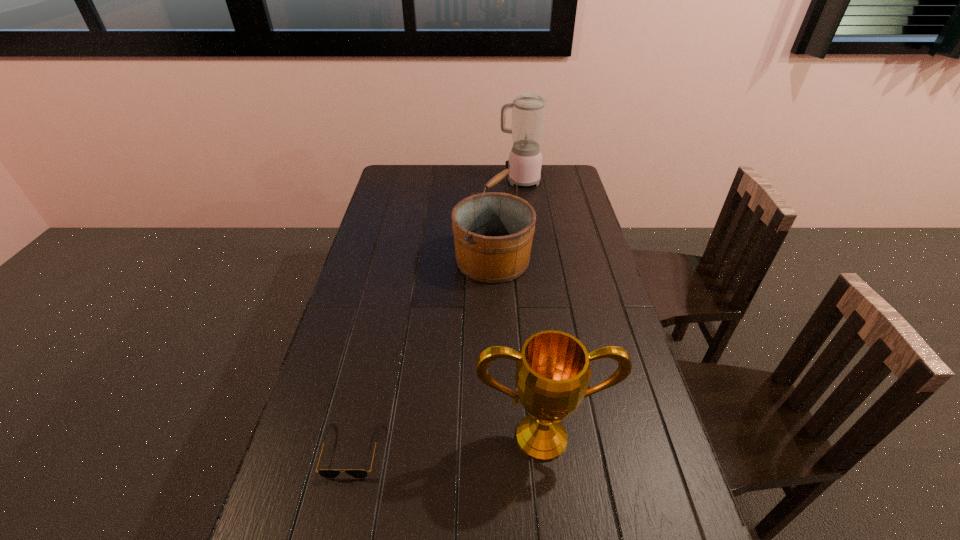
I want to click on object located in the far edge section of the desktop, so point(528,109).

The image size is (960, 540). I want to click on object present at the left edge, so click(325, 473).

Locate an element on the screen. This screenshot has width=960, height=540. food processor situated at the right edge is located at coordinates (528, 109).

Find the location of a particular element. Image resolution: width=960 pixels, height=540 pixels. award situated at the right edge is located at coordinates (553, 368).

You are a GUI agent. You are given a task and a screenshot of the screen. Output one action in this format:
    pyautogui.click(x=<x>, y=<y>)
    Task: Click on the object present at the far right corner
    
    Given the screenshot: What is the action you would take?
    pyautogui.click(x=528, y=109)

This screenshot has height=540, width=960. In order to click on vacant space at the far edge of the desktop in this screenshot , I will do `click(525, 186)`.

In order to click on vacant space at the left edge in this screenshot , I will do point(374,214).

In the image, there is a desktop. Where is `vacant space at the right edge`? vacant space at the right edge is located at coordinates (587, 290).

In the image, there is a desktop. Where is `vacant space at the far right corner`? Image resolution: width=960 pixels, height=540 pixels. vacant space at the far right corner is located at coordinates (568, 185).

You are a GUI agent. You are given a task and a screenshot of the screen. Output one action in this format:
    pyautogui.click(x=<x>, y=<y>)
    Task: Click on the free spot between the food processor and the leftmost object
    The height and width of the screenshot is (540, 960).
    Given the screenshot: What is the action you would take?
    pyautogui.click(x=436, y=315)